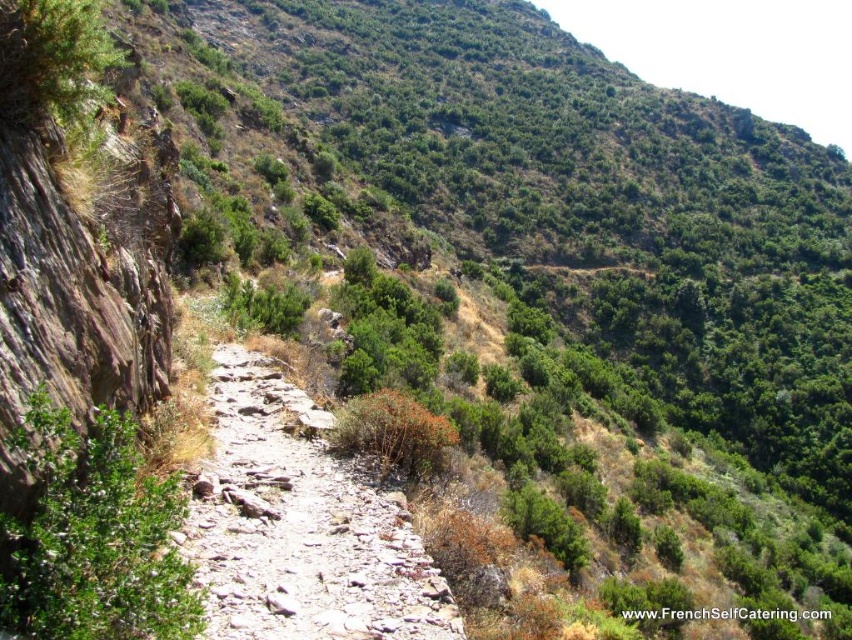
Question: Which object appears closest to the camera in this image?

Choices:
 (A) green leafy bush at center
 (B) dusty stone path at center

Answer: (A)

Question: Can you confirm if dusty stone path at center is wider than green leafy bush at center?

Choices:
 (A) no
 (B) yes

Answer: (B)

Question: Which of the following is the closest to the observer?

Choices:
 (A) (337, 540)
 (B) (177, 589)

Answer: (B)

Question: Does dusty stone path at center appear on the right side of green leafy bush at center?

Choices:
 (A) yes
 (B) no

Answer: (A)

Question: Which object appears farthest from the camera in this image?

Choices:
 (A) green leafy bush at center
 (B) dusty stone path at center

Answer: (B)

Question: Is dusty stone path at center to the right of green leafy bush at center from the viewer's perspective?

Choices:
 (A) no
 (B) yes

Answer: (B)